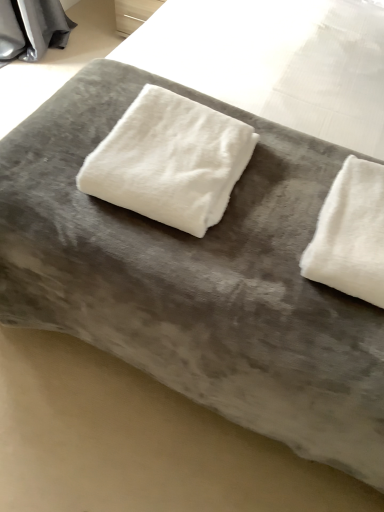
You are a GUI agent. You are given a task and a screenshot of the screen. Output one action in this format:
    pyautogui.click(x=<x>, y=<y>)
    Task: Click on the white fluffy towel at center, marked as the 2th towel in a right-to-left arrangement
    This screenshot has width=384, height=512.
    Given the screenshot: What is the action you would take?
    pyautogui.click(x=170, y=161)

This screenshot has width=384, height=512. What do you see at coordinates (170, 161) in the screenshot?
I see `white fluffy towel at center, marked as the 2th towel in a right-to-left arrangement` at bounding box center [170, 161].

Where is `white fluffy towel at right, the first towel viewed from the right`? white fluffy towel at right, the first towel viewed from the right is located at coordinates (350, 234).

Image resolution: width=384 pixels, height=512 pixels. What do you see at coordinates (350, 234) in the screenshot?
I see `white fluffy towel at right, the first towel viewed from the right` at bounding box center [350, 234].

In order to click on white fluffy towel at center, placed as the first towel when sorted from left to right in this screenshot , I will do point(170,161).

Does white fluffy towel at center, marked as the 2th towel in a right-to-left arrangement, appear on the right side of white fluffy towel at right, the first towel viewed from the right?

In fact, white fluffy towel at center, marked as the 2th towel in a right-to-left arrangement, is to the left of white fluffy towel at right, the first towel viewed from the right.

Which object is closer to the camera, white fluffy towel at center, placed as the first towel when sorted from left to right, or white fluffy towel at right, the first towel viewed from the right?

Positioned in front is white fluffy towel at right, the first towel viewed from the right.

Between point (216, 115) and point (346, 181), which one is positioned in front?

Point (346, 181)

From the image's perspective, is white fluffy towel at center, marked as the 2th towel in a right-to-left arrangement, located above white fluffy towel at right, the first towel viewed from the right?

Indeed, from the image's perspective, white fluffy towel at center, marked as the 2th towel in a right-to-left arrangement, is shown above white fluffy towel at right, the first towel viewed from the right.

From a real-world perspective, who is located lower, white fluffy towel at center, marked as the 2th towel in a right-to-left arrangement, or white fluffy towel at right, the first towel viewed from the right?

white fluffy towel at right, the first towel viewed from the right, is physically lower.

Between white fluffy towel at center, marked as the 2th towel in a right-to-left arrangement, and white fluffy towel at right, the first towel viewed from the right, which one has smaller width?

white fluffy towel at right, the first towel viewed from the right, is thinner.

Is white fluffy towel at center, marked as the 2th towel in a right-to-left arrangement, taller than white fluffy towel at right, the second towel from the left?

Yes.

Which of these two, white fluffy towel at center, placed as the first towel when sorted from left to right, or white fluffy towel at right, the first towel viewed from the right, is smaller?

white fluffy towel at right, the first towel viewed from the right, is smaller.

Is white fluffy towel at center, marked as the 2th towel in a right-to-left arrangement, located outside white fluffy towel at right, the second towel from the left?

Yes, white fluffy towel at center, marked as the 2th towel in a right-to-left arrangement, is outside of white fluffy towel at right, the second towel from the left.

Is white fluffy towel at center, marked as the 2th towel in a right-to-left arrangement, next to white fluffy towel at right, the first towel viewed from the right?

There is a gap between white fluffy towel at center, marked as the 2th towel in a right-to-left arrangement, and white fluffy towel at right, the first towel viewed from the right.

Is white fluffy towel at center, marked as the 2th towel in a right-to-left arrangement, facing towards white fluffy towel at right, the first towel viewed from the right?

No, white fluffy towel at center, marked as the 2th towel in a right-to-left arrangement, does not turn towards white fluffy towel at right, the first towel viewed from the right.

How different are the orientations of white fluffy towel at center, placed as the first towel when sorted from left to right, and white fluffy towel at right, the second towel from the left, in degrees?

0.386 degrees.

Where is `towel above the white fluffy towel at right, the first towel viewed from the right (from the image's perspective)`? This screenshot has height=512, width=384. towel above the white fluffy towel at right, the first towel viewed from the right (from the image's perspective) is located at coordinates (170, 161).

Considering the relative positions of white fluffy towel at right, the first towel viewed from the right, and white fluffy towel at center, placed as the first towel when sorted from left to right, in the image provided, is white fluffy towel at right, the first towel viewed from the right, to the left of white fluffy towel at center, placed as the first towel when sorted from left to right, from the viewer's perspective?

In fact, white fluffy towel at right, the first towel viewed from the right, is to the right of white fluffy towel at center, placed as the first towel when sorted from left to right.

Which is in front, white fluffy towel at right, the second towel from the left, or white fluffy towel at center, placed as the first towel when sorted from left to right?

white fluffy towel at right, the second towel from the left, is more forward.

Is point (365, 230) behind point (102, 142)?

No, (365, 230) is closer to viewer.

From the image's perspective, between white fluffy towel at right, the second towel from the left, and white fluffy towel at center, placed as the first towel when sorted from left to right, which one is located above?

white fluffy towel at center, placed as the first towel when sorted from left to right, is shown above in the image.

From a real-world perspective, which object rests below the other?

From a 3D spatial view, white fluffy towel at right, the second towel from the left, is below.

Is white fluffy towel at right, the first towel viewed from the right, wider or thinner than white fluffy towel at center, marked as the 2th towel in a right-to-left arrangement?

white fluffy towel at right, the first towel viewed from the right, is thinner than white fluffy towel at center, marked as the 2th towel in a right-to-left arrangement.

Who is taller, white fluffy towel at right, the second towel from the left, or white fluffy towel at center, placed as the first towel when sorted from left to right?

white fluffy towel at center, placed as the first towel when sorted from left to right, is taller.

Is white fluffy towel at right, the first towel viewed from the right, bigger than white fluffy towel at center, marked as the 2th towel in a right-to-left arrangement?

No.

Would you say white fluffy towel at right, the first towel viewed from the right, is outside white fluffy towel at center, placed as the first towel when sorted from left to right?

Yes.

Are white fluffy towel at right, the first towel viewed from the right, and white fluffy towel at center, marked as the 2th towel in a right-to-left arrangement, far apart?

That's not correct — white fluffy towel at right, the first towel viewed from the right, is a little close to white fluffy towel at center, marked as the 2th towel in a right-to-left arrangement.

Does white fluffy towel at right, the first towel viewed from the right, turn towards white fluffy towel at center, placed as the first towel when sorted from left to right?

No, white fluffy towel at right, the first towel viewed from the right, is not aimed at white fluffy towel at center, placed as the first towel when sorted from left to right.

Image resolution: width=384 pixels, height=512 pixels. In order to click on towel beneath the white fluffy towel at center, placed as the first towel when sorted from left to right (from a real-world perspective) in this screenshot , I will do `click(350, 234)`.

Locate an element on the screen. This screenshot has width=384, height=512. towel that is on the left side of white fluffy towel at right, the second towel from the left is located at coordinates (170, 161).

Where is `towel above the white fluffy towel at right, the second towel from the left (from the image's perspective)`? towel above the white fluffy towel at right, the second towel from the left (from the image's perspective) is located at coordinates (170, 161).